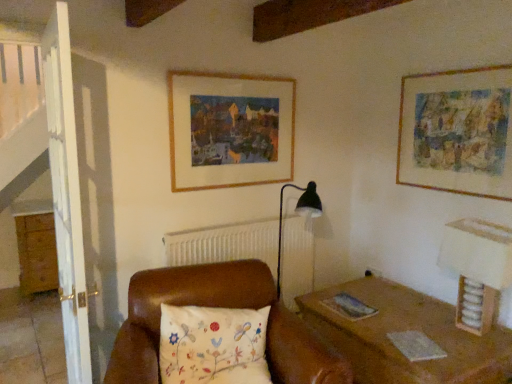
Question: Considering their positions, is wooden dresser at left located in front of or behind floral-patterned fabric pillow at center?

Choices:
 (A) front
 (B) behind

Answer: (B)

Question: From the image's perspective, is wooden dresser at left above or below floral-patterned fabric pillow at center?

Choices:
 (A) below
 (B) above

Answer: (B)

Question: Estimate the real-world distances between objects in this image. Which object is closer to the watercolor paper painting at upper right, acting as the 2th picture frame starting from the left?

Choices:
 (A) floral-patterned fabric pillow at center
 (B) wooden table lamp at right
 (C) wooden frame at upper center, placed as the second picture frame when sorted from right to left
 (D) wooden dresser at left

Answer: (B)

Question: Which is nearer to the floral-patterned fabric pillow at center?

Choices:
 (A) wooden table lamp at right
 (B) watercolor paper painting at upper right, the 1th picture frame positioned from the right
 (C) wooden dresser at left
 (D) wooden frame at upper center, placed as the second picture frame when sorted from right to left

Answer: (D)